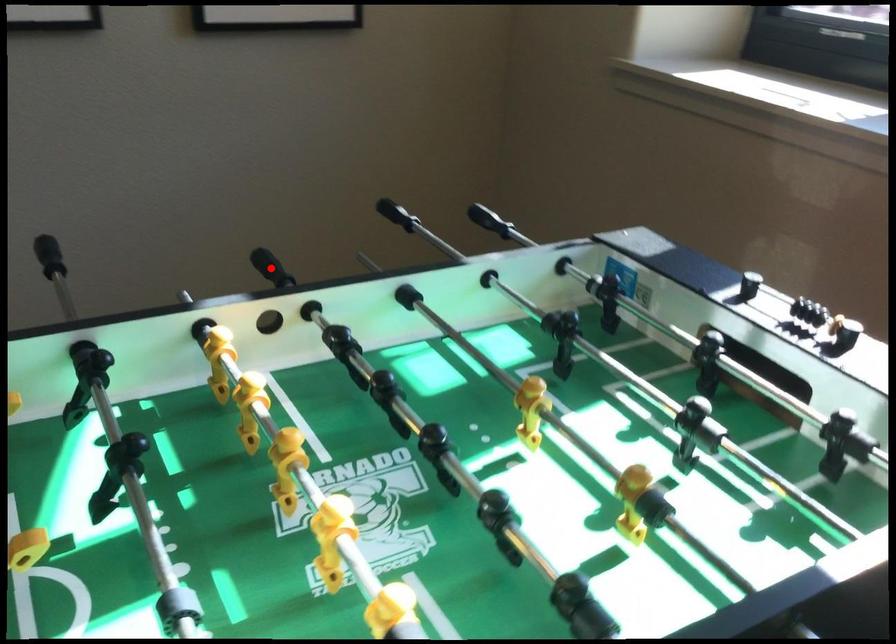
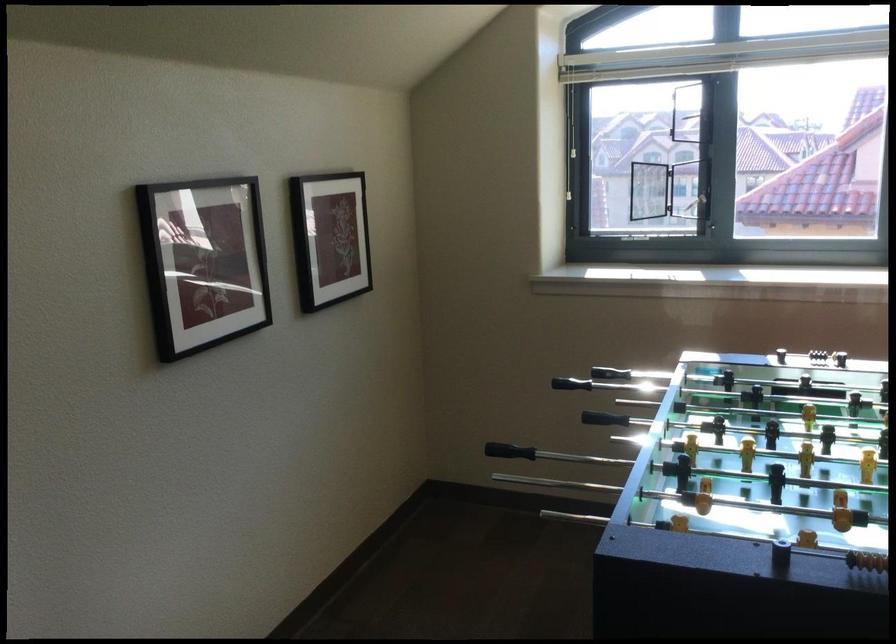
Find the pixel in the second image that matches the highlighted location in the first image.

(604, 412)